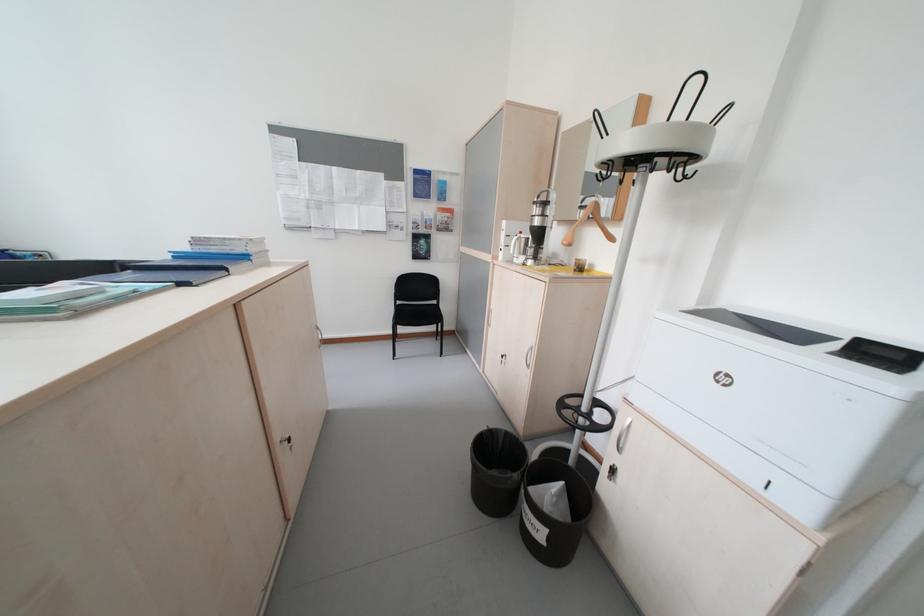
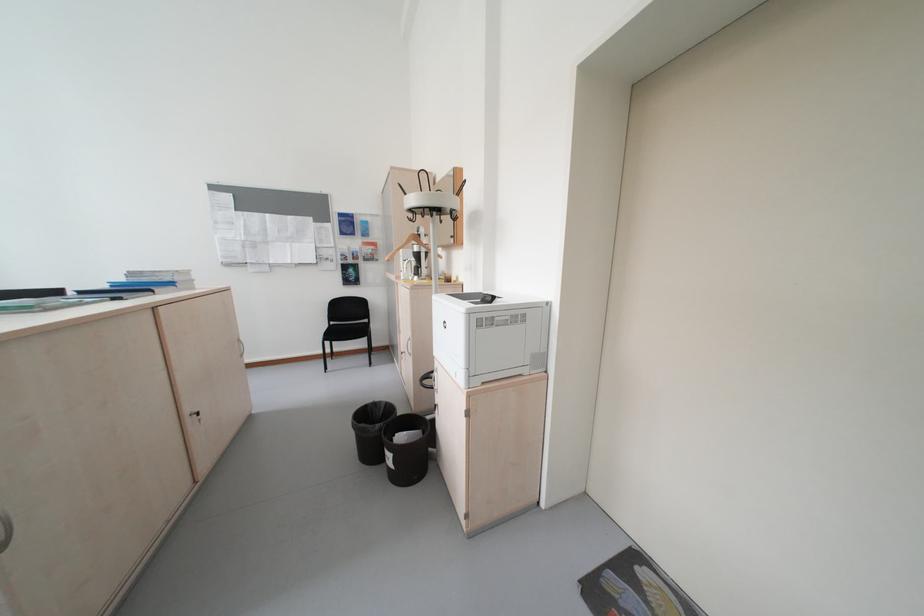
The point at (224, 251) is marked in the first image. Where is the corresponding point in the second image?

(155, 281)